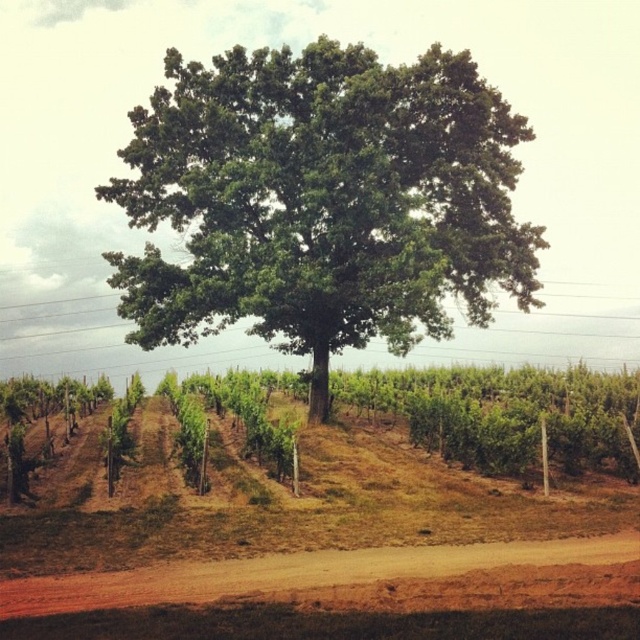
Question: Among these objects, which one is nearest to the camera?

Choices:
 (A) brown dirt track at lower center
 (B) green leafy oak at center

Answer: (A)

Question: Does green leafy oak at center appear on the left side of brown dirt track at lower center?

Choices:
 (A) yes
 (B) no

Answer: (A)

Question: Does green leafy oak at center come in front of brown dirt track at lower center?

Choices:
 (A) yes
 (B) no

Answer: (B)

Question: Which object appears closest to the camera in this image?

Choices:
 (A) green leafy oak at center
 (B) brown dirt track at lower center

Answer: (B)

Question: Can you confirm if green leafy oak at center is thinner than brown dirt track at lower center?

Choices:
 (A) no
 (B) yes

Answer: (A)